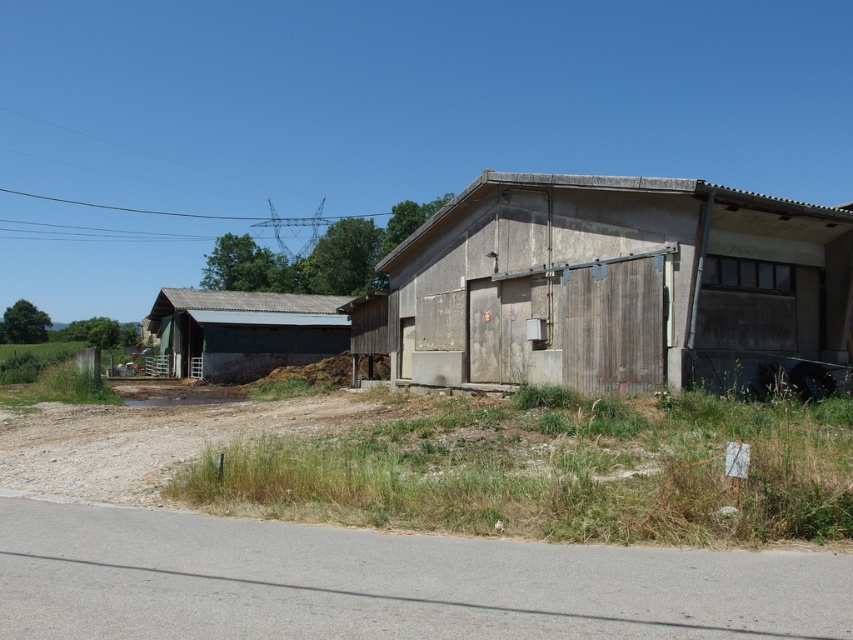
Does point (407, 275) lie behind point (189, 305)?

No, (407, 275) is in front of (189, 305).

Between point (396, 369) and point (258, 365), which one is positioned behind?

Point (258, 365)

Is point (532, 243) positioned behind point (222, 321)?

No, (532, 243) is in front of (222, 321).

I want to click on rustic wood barn at center, so click(618, 285).